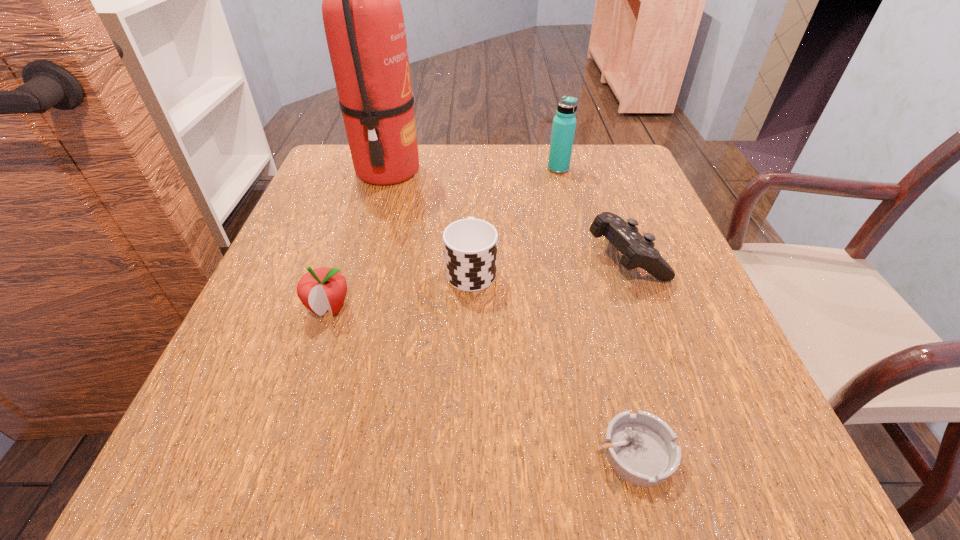
At what (x,y) coordinates should I click in order to perform the action: click on free region at the near right corner of the desktop. Please return your answer as a coordinate pair (x, y). Looking at the image, I should click on (728, 431).

You are a GUI agent. You are given a task and a screenshot of the screen. Output one action in this format:
    pyautogui.click(x=<x>, y=<y>)
    Task: Click on the unoccupied position between the apple and the cup
    The image size is (960, 540).
    Given the screenshot: What is the action you would take?
    pyautogui.click(x=400, y=288)

Where is `empty space between the fire extinguisher and the third object from left to right`? The image size is (960, 540). empty space between the fire extinguisher and the third object from left to right is located at coordinates (429, 220).

The height and width of the screenshot is (540, 960). Find the location of `vacant space that is in between the control and the fourth object from right to left`. vacant space that is in between the control and the fourth object from right to left is located at coordinates (548, 263).

Identify the location of empty location between the water bottle and the control. The width and height of the screenshot is (960, 540). (591, 213).

Locate an element on the screen. The height and width of the screenshot is (540, 960). empty location between the nearest object and the apple is located at coordinates pos(482,380).

What are the coordinates of `free area in between the water bottle and the tallest object` in the screenshot? It's located at tap(473, 170).

This screenshot has height=540, width=960. Identify the location of unoccupied position between the control and the nearest object. (630, 355).

The width and height of the screenshot is (960, 540). Identify the location of empty space between the tallest object and the water bottle. (473, 170).

Select which object is the fifth closest to the second shortest object. Please provide its 2D coordinates. Your answer should be formatted as a tuple, i.e. [(x, y)], where the tuple contains the x and y coordinates of a point satisfying the conditions above.

[(321, 289)]